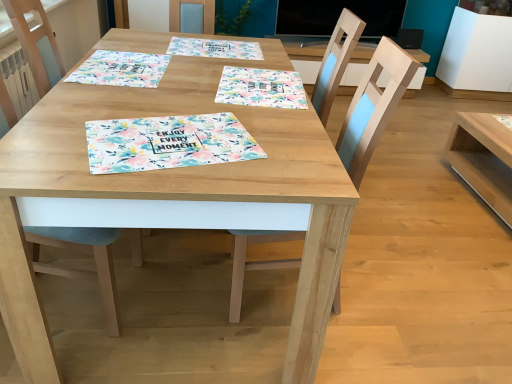
Question: Could you tell me if floral paper placemat at upper center, the second tablecloth in the left-to-right sequence, is facing floral paper placemat at center?

Choices:
 (A) yes
 (B) no

Answer: (B)

Question: Can you confirm if floral paper placemat at upper center, marked as the second tablecloth in a right-to-left arrangement, is taller than floral paper placemat at center?

Choices:
 (A) yes
 (B) no

Answer: (A)

Question: From the image's perspective, is floral paper placemat at upper center, marked as the second tablecloth in a right-to-left arrangement, below floral paper placemat at center?

Choices:
 (A) yes
 (B) no

Answer: (B)

Question: Does floral paper placemat at upper center, the second tablecloth in the left-to-right sequence, appear on the left side of floral paper placemat at center?

Choices:
 (A) yes
 (B) no

Answer: (B)

Question: Could floral paper placemat at center be considered to be inside floral paper placemat at upper center, marked as the second tablecloth in a right-to-left arrangement?

Choices:
 (A) no
 (B) yes

Answer: (A)

Question: From the image's perspective, is floral paper placemat at upper center, marked as the second tablecloth in a right-to-left arrangement, on top of floral paper placemat at center?

Choices:
 (A) no
 (B) yes

Answer: (B)

Question: From a real-world perspective, is floral paper placemat at upper left, which ranks as the 3th tablecloth in right-to-left order, located higher than wooden chair at center, the second chair in the left-to-right sequence?

Choices:
 (A) yes
 (B) no

Answer: (A)

Question: Is floral paper placemat at upper left, which ranks as the 3th tablecloth in right-to-left order, further to the viewer compared to wooden chair at center, the first chair when ordered from right to left?

Choices:
 (A) yes
 (B) no

Answer: (A)

Question: Does floral paper placemat at upper left, which ranks as the 3th tablecloth in right-to-left order, appear on the right side of wooden chair at center, the first chair when ordered from right to left?

Choices:
 (A) yes
 (B) no

Answer: (B)

Question: Could you tell me if floral paper placemat at upper left, which is the 1th tablecloth in left-to-right order, is turned towards wooden chair at center, the first chair when ordered from right to left?

Choices:
 (A) yes
 (B) no

Answer: (B)

Question: Is floral paper placemat at upper left, which ranks as the 3th tablecloth in right-to-left order, not close to wooden chair at center, the second chair in the left-to-right sequence?

Choices:
 (A) yes
 (B) no

Answer: (B)

Question: Is floral paper placemat at upper left, which ranks as the 3th tablecloth in right-to-left order, looking in the opposite direction of wooden chair at center, the first chair when ordered from right to left?

Choices:
 (A) yes
 (B) no

Answer: (B)

Question: Considering the relative sizes of light wood table at right, placed as the first table when sorted from right to left, and floral paper placemat at center, marked as the first tablecloth in a right-to-left arrangement, in the image provided, is light wood table at right, placed as the first table when sorted from right to left, wider than floral paper placemat at center, marked as the first tablecloth in a right-to-left arrangement,?

Choices:
 (A) no
 (B) yes

Answer: (B)